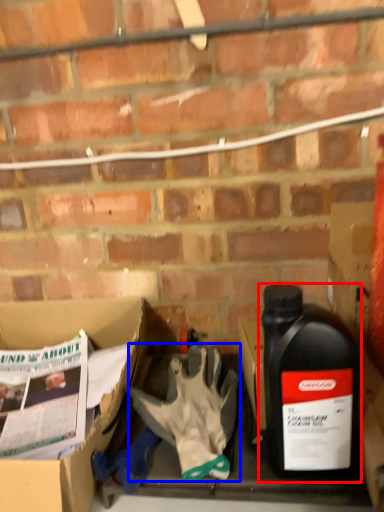
Question: Among these objects, which one is farthest to the camera, bottle (highlighted by a red box) or glove (highlighted by a blue box)?

Choices:
 (A) bottle
 (B) glove

Answer: (B)